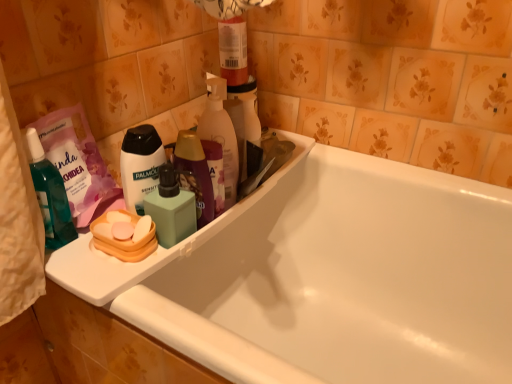
Question: Is translucent plastic bottle at upper center wider or thinner than orange plastic soap at left, the first personal care in the bottom-to-top sequence?

Choices:
 (A) thin
 (B) wide

Answer: (A)

Question: Visually, is translucent plastic bottle at upper center positioned to the left or to the right of orange plastic soap at left, the first personal care in the bottom-to-top sequence?

Choices:
 (A) right
 (B) left

Answer: (A)

Question: Based on their relative distances, which object is farther from the translucent teal bottle at left, the second toiletry from the right?

Choices:
 (A) white glossy bathtub at center
 (B) orange plastic soap at left, positioned as the 2th personal care in top-to-bottom order
 (C) green matte soap dispenser at center, the second toiletry positioned from the left
 (D) translucent plastic bottle at upper center
 (E) white matte body wash at center, arranged as the 1th personal care when viewed from the top

Answer: (A)

Question: Which object is positioned closest to the white plastic tray at upper left?

Choices:
 (A) translucent plastic bottle at upper center
 (B) translucent teal bottle at left, the second toiletry from the right
 (C) white matte body wash at center, arranged as the 1th personal care when viewed from the top
 (D) green matte soap dispenser at center, the second toiletry positioned from the left
 (E) orange plastic soap at left, positioned as the 2th personal care in top-to-bottom order

Answer: (D)